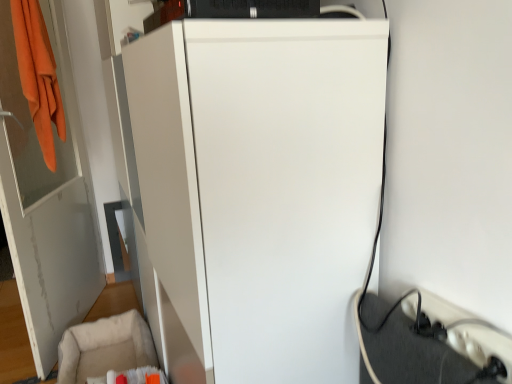
At what (x,y) coordinates should I click in order to perform the action: click on beige fabric swivel chair at lower left. Please return your answer as a coordinate pair (x, y). Looking at the image, I should click on (108, 351).

Image resolution: width=512 pixels, height=384 pixels. In order to click on white plastic extension cord at lower right in this screenshot , I will do `click(470, 334)`.

Image resolution: width=512 pixels, height=384 pixels. In order to click on white matte refrigerator at center in this screenshot , I will do `click(261, 186)`.

Who is taller, white plastic extension cord at lower right or white matte refrigerator at center?

white matte refrigerator at center.

Is the surface of white plastic extension cord at lower right in direct contact with white matte refrigerator at center?

No, white plastic extension cord at lower right is not touching white matte refrigerator at center.

Based on the photo, do you think white plastic extension cord at lower right is within white matte refrigerator at center, or outside of it?

white plastic extension cord at lower right is outside white matte refrigerator at center.

Consider the image. How far apart are white plastic extension cord at lower right and white matte refrigerator at center?

white plastic extension cord at lower right and white matte refrigerator at center are 14.18 inches apart from each other.

Is white matte refrigerator at center not inside white plastic extension cord at lower right?

Yes.

Measure the distance between white matte refrigerator at center and white plastic extension cord at lower right.

white matte refrigerator at center is 14.18 inches from white plastic extension cord at lower right.

Can you confirm if white matte refrigerator at center is bigger than white plastic extension cord at lower right?

Yes, white matte refrigerator at center is bigger than white plastic extension cord at lower right.

How many degrees apart are the facing directions of white matte refrigerator at center and white plastic extension cord at lower right?

The facing directions of white matte refrigerator at center and white plastic extension cord at lower right are 0.608 degrees apart.

Between white plastic extension cord at lower right and white glossy door at left, which one has larger size?

white glossy door at left.

From a real-world perspective, which is physically below, white plastic extension cord at lower right or white glossy door at left?

From a 3D spatial view, white plastic extension cord at lower right is below.

Which point is more forward, [424,298] or [75,155]?

Point [424,298]

Is white plastic extension cord at lower right shorter than white glossy door at left?

Yes, white plastic extension cord at lower right is shorter than white glossy door at left.

Would you say white glossy door at left is a long distance from beige fabric swivel chair at lower left?

No, white glossy door at left is not far away from beige fabric swivel chair at lower left.

From the image's perspective, is white glossy door at left located beneath beige fabric swivel chair at lower left?

Incorrect, from the image's perspective, white glossy door at left is higher than beige fabric swivel chair at lower left.

Which of these two, white glossy door at left or beige fabric swivel chair at lower left, stands taller?

Standing taller between the two is white glossy door at left.

Between white glossy door at left and white plastic extension cord at lower right, which one has larger width?

Wider between the two is white glossy door at left.

Considering the sizes of objects white glossy door at left and white plastic extension cord at lower right in the image provided, who is taller, white glossy door at left or white plastic extension cord at lower right?

white glossy door at left.

What's the angular difference between white glossy door at left and white plastic extension cord at lower right's facing directions?

They differ by 18.7 degrees in their facing directions.

Is white glossy door at left positioned beyond the bounds of white plastic extension cord at lower right?

Yes, white glossy door at left is not within white plastic extension cord at lower right.

Which is less distant, (97, 338) or (237, 107)?

The point (237, 107) is closer.

Who is bigger, beige fabric swivel chair at lower left or white matte refrigerator at center?

Bigger between the two is white matte refrigerator at center.

Looking at this image, is beige fabric swivel chair at lower left not inside white matte refrigerator at center?

beige fabric swivel chair at lower left lies outside white matte refrigerator at center's area.

Could white glossy door at left be considered to be inside beige fabric swivel chair at lower left?

That's incorrect, white glossy door at left is not inside beige fabric swivel chair at lower left.

Can you confirm if beige fabric swivel chair at lower left is positioned to the left of white glossy door at left?

No, beige fabric swivel chair at lower left is not to the left of white glossy door at left.

Looking at the image, does beige fabric swivel chair at lower left seem bigger or smaller compared to white glossy door at left?

beige fabric swivel chair at lower left is smaller than white glossy door at left.

In the image, there is a white matte refrigerator at center. What are the coordinates of `extension cord below it (from the image's perspective)` in the screenshot? It's located at (470, 334).

The width and height of the screenshot is (512, 384). I want to click on extension cord beneath the white matte refrigerator at center (from a real-world perspective), so click(470, 334).

Estimate the real-world distances between objects in this image. Which object is further from white matte refrigerator at center, white glossy door at left or white plastic extension cord at lower right?

Among the two, white glossy door at left is located further to white matte refrigerator at center.

Estimate the real-world distances between objects in this image. Which object is closer to white matte refrigerator at center, beige fabric swivel chair at lower left or white glossy door at left?

The object closer to white matte refrigerator at center is beige fabric swivel chair at lower left.

Considering their positions, is beige fabric swivel chair at lower left positioned closer to white plastic extension cord at lower right than white matte refrigerator at center?

white matte refrigerator at center is positioned closer to the anchor white plastic extension cord at lower right.

Estimate the real-world distances between objects in this image. Which object is further from white glossy door at left, white plastic extension cord at lower right or white matte refrigerator at center?

The object further to white glossy door at left is white plastic extension cord at lower right.

Looking at the image, which one is located closer to beige fabric swivel chair at lower left, white plastic extension cord at lower right or white glossy door at left?

white glossy door at left is positioned closer to the anchor beige fabric swivel chair at lower left.

Which object lies further to the anchor point white plastic extension cord at lower right, white glossy door at left or beige fabric swivel chair at lower left?

white glossy door at left lies further to white plastic extension cord at lower right than the other object.

Based on their spatial positions, is white matte refrigerator at center or white glossy door at left closer to white plastic extension cord at lower right?

white matte refrigerator at center is closer to white plastic extension cord at lower right.

Based on their spatial positions, is beige fabric swivel chair at lower left or white plastic extension cord at lower right further from white glossy door at left?

Based on the image, white plastic extension cord at lower right appears to be further to white glossy door at left.

The height and width of the screenshot is (384, 512). In order to click on door positioned between white matte refrigerator at center and beige fabric swivel chair at lower left from near to far in this screenshot , I will do `click(47, 201)`.

Where is `refrigerator between white plastic extension cord at lower right and beige fabric swivel chair at lower left from front to back`? The image size is (512, 384). refrigerator between white plastic extension cord at lower right and beige fabric swivel chair at lower left from front to back is located at coordinates (261, 186).

This screenshot has width=512, height=384. I want to click on refrigerator located between white glossy door at left and white plastic extension cord at lower right in the left-right direction, so click(x=261, y=186).

I want to click on swivel chair situated between white glossy door at left and white plastic extension cord at lower right from left to right, so click(x=108, y=351).